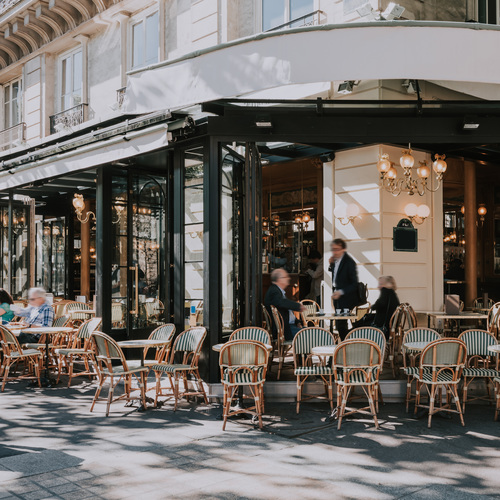
Find the location of a particular element. table is located at coordinates (44, 330), (139, 343), (324, 347), (418, 346), (494, 350), (340, 314), (452, 318).